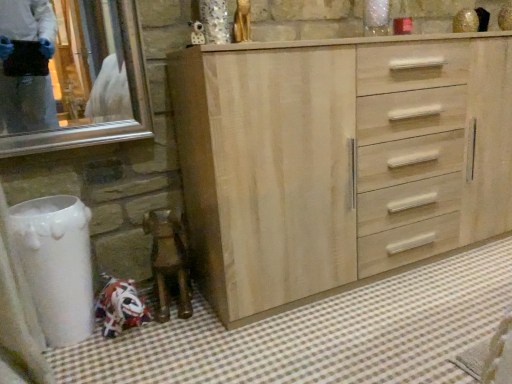
Locate an element on the screen. This screenshot has height=384, width=512. free spot in front of light wood cabinet at center is located at coordinates (390, 318).